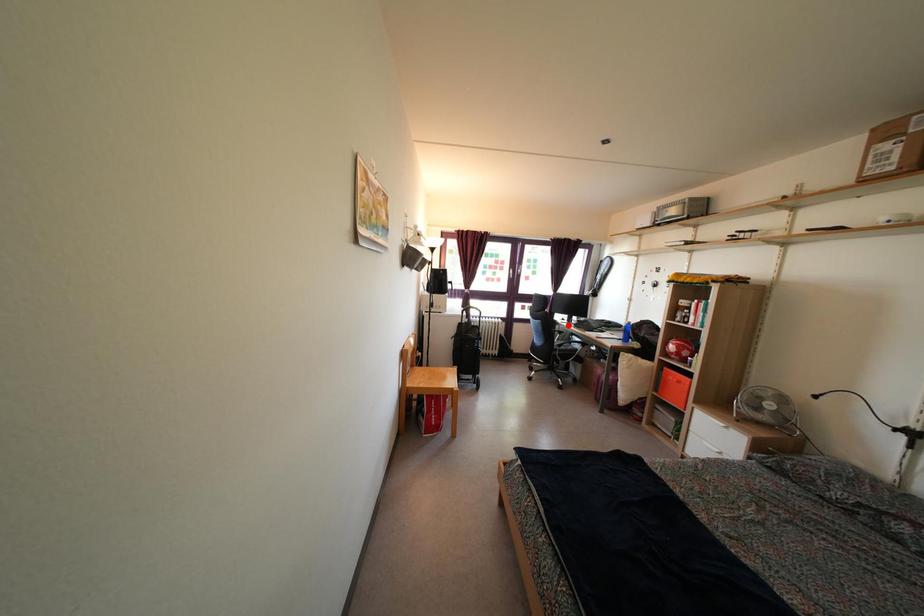
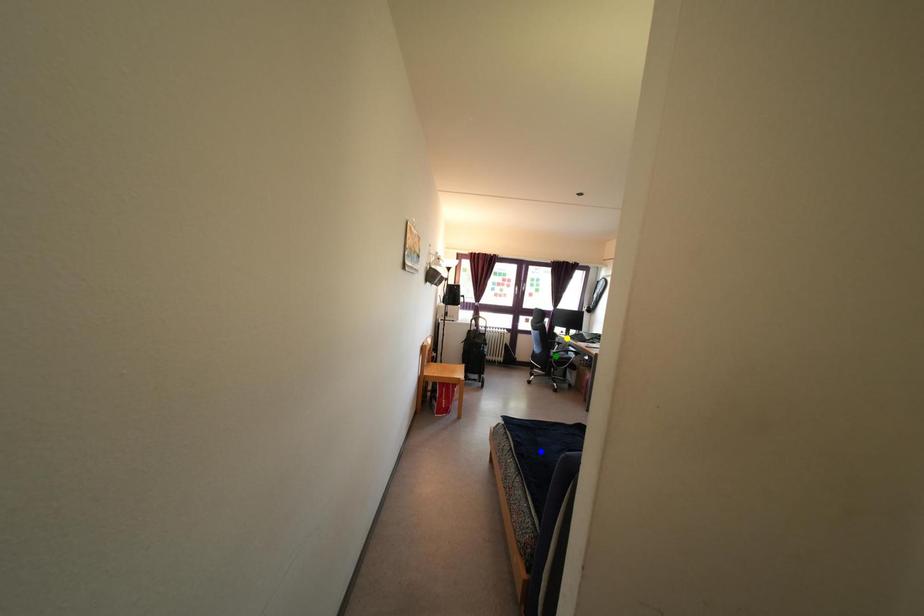
Question: I am providing you with two images of the same scene from different viewpoints. A red point is marked on the first image. You are given multiple points on the second image. In image 2, which mark is for the same physical point as the one in image 1?

Choices:
 (A) yellow point
 (B) blue point
 (C) green point

Answer: (A)